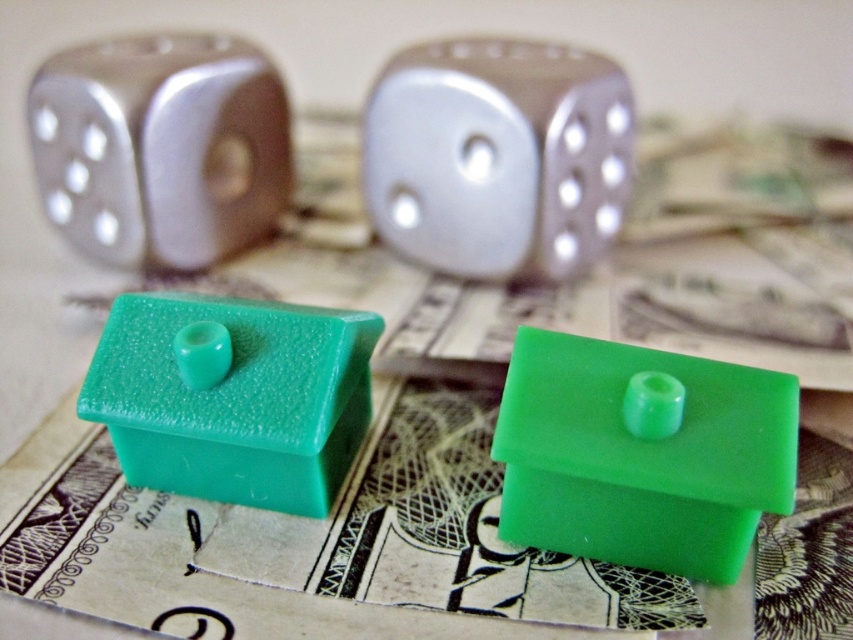
Question: Is metallic silver die at upper left smaller than teal matte house at center?

Choices:
 (A) no
 (B) yes

Answer: (A)

Question: Is metallic silver die at upper left to the left of teal matte house at center from the viewer's perspective?

Choices:
 (A) yes
 (B) no

Answer: (A)

Question: Estimate the real-world distances between objects in this image. Which object is closer to the metallic silver die at upper left?

Choices:
 (A) metallic silver die at center
 (B) green matte house at lower right

Answer: (A)

Question: Is green matte house at lower right to the right of teal matte house at center from the viewer's perspective?

Choices:
 (A) yes
 (B) no

Answer: (A)

Question: Among these objects, which one is nearest to the camera?

Choices:
 (A) green matte house at lower right
 (B) metallic silver die at upper left
 (C) teal matte house at center

Answer: (A)

Question: Estimate the real-world distances between objects in this image. Which object is closer to the metallic silver die at upper left?

Choices:
 (A) green matte house at lower right
 (B) metallic silver die at center

Answer: (B)